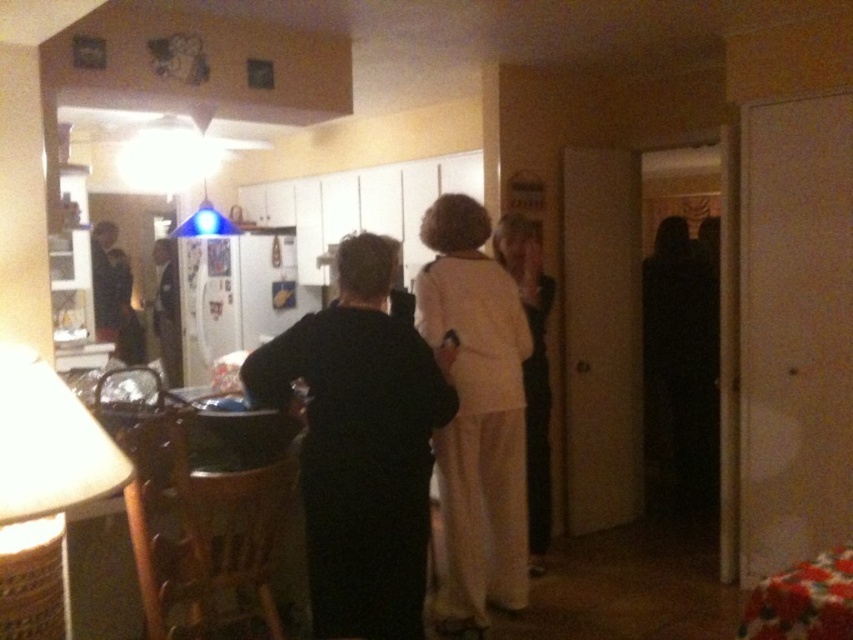
Question: Is light beige fabric dress at center above woven bamboo lampshade at lower left?

Choices:
 (A) yes
 (B) no

Answer: (B)

Question: Among these objects, which one is farthest from the camera?

Choices:
 (A) dark brown leather jacket at left
 (B) white fabric dress at center
 (C) black matte dress at center
 (D) light beige fabric dress at center

Answer: (A)

Question: Can you confirm if woven bamboo lampshade at lower left is bigger than white fabric dress at center?

Choices:
 (A) no
 (B) yes

Answer: (A)

Question: Which point appears farthest from the camera in this image?

Choices:
 (A) pyautogui.click(x=173, y=285)
 (B) pyautogui.click(x=109, y=340)
 (C) pyautogui.click(x=62, y=515)

Answer: (A)

Question: Does light beige fabric dress at center have a lesser width compared to shiny black suit at left?

Choices:
 (A) yes
 (B) no

Answer: (A)

Question: Which of these objects is positioned farthest from the black matte dress at center?

Choices:
 (A) dark brown leather jacket at left
 (B) white fabric dress at center

Answer: (A)